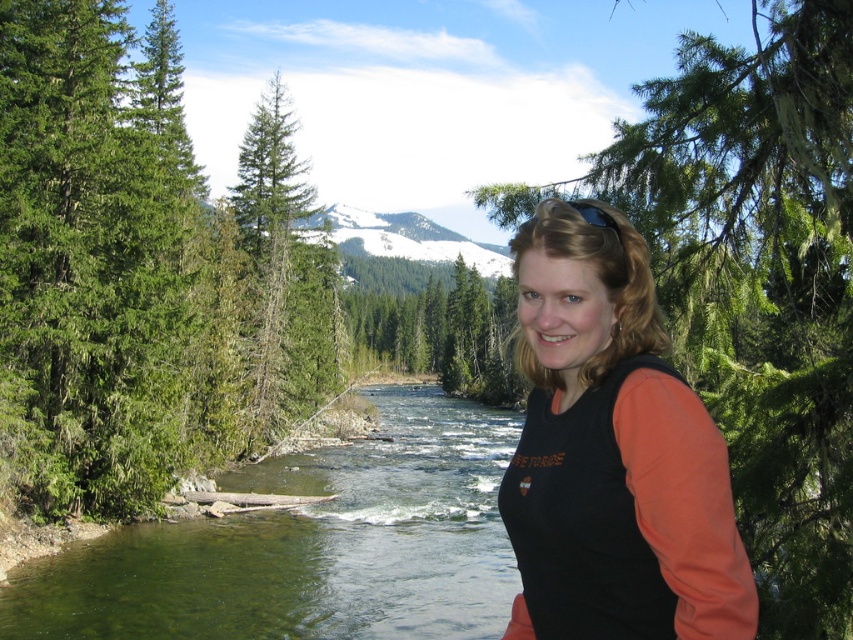
This screenshot has width=853, height=640. Describe the element at coordinates (759, 280) in the screenshot. I see `green leafy tree at center` at that location.

Which of these two, green leafy tree at center or black matte shirt at center, stands taller?

green leafy tree at center

Who is more distant from viewer, (741, 422) or (558, 547)?

The point (741, 422) is behind.

Identify the location of green leafy tree at center. The image size is (853, 640). (759, 280).

Which of these two, green smooth water at center or green matte tree at center, stands shorter?

green smooth water at center

Can you confirm if green smooth water at center is shorter than green matte tree at center?

Correct, green smooth water at center is not as tall as green matte tree at center.

Between point (440, 532) and point (451, 285), which one is positioned in front?

Positioned in front is point (440, 532).

Where is `green smooth water at center`? This screenshot has height=640, width=853. green smooth water at center is located at coordinates (309, 547).

Who is higher up, green coniferous trees at left or green matte tree at center?

Positioned higher is green coniferous trees at left.

Is green coniferous trees at left thinner than green matte tree at center?

Yes.

Is point (239, 310) closer to viewer compared to point (370, 352)?

Yes, point (239, 310) is in front of point (370, 352).

This screenshot has height=640, width=853. In order to click on green coniferous trees at left in this screenshot , I will do `click(143, 269)`.